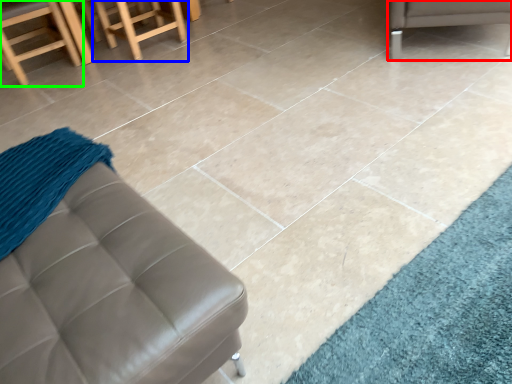
Question: Which is nearer to the furniture (highlighted by a red box)? stool (highlighted by a blue box) or chair (highlighted by a green box).

Choices:
 (A) stool
 (B) chair

Answer: (A)